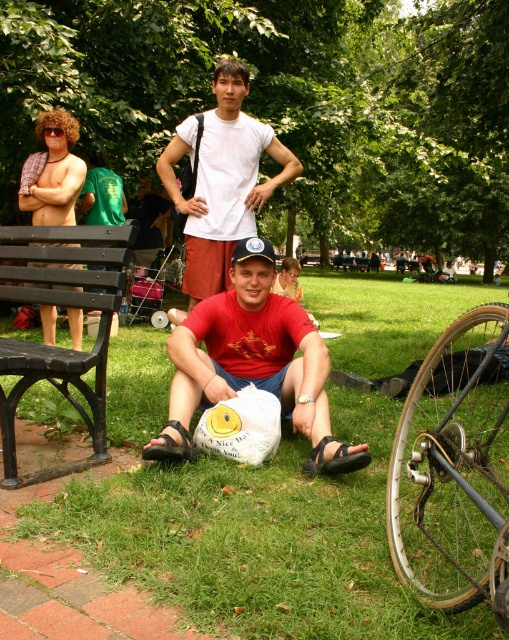
Does black wood bench at left appear over green fabric backpack at upper left?

Actually, black wood bench at left is below green fabric backpack at upper left.

Is black wood bench at left shorter than green fabric backpack at upper left?

In fact, black wood bench at left may be taller than green fabric backpack at upper left.

This screenshot has height=640, width=509. Identify the location of black wood bench at left. (56, 346).

Where is `black wood bench at left`? black wood bench at left is located at coordinates (56, 346).

Is green grass at lower center to the right of white cotton t-shirt at center from the viewer's perspective?

Correct, you'll find green grass at lower center to the right of white cotton t-shirt at center.

Is point (189, 540) closer to camera compared to point (218, 220)?

Yes, point (189, 540) is closer to viewer.

At what (x,y) coordinates should I click in order to perform the action: click on green grass at lower center. Please return your answer as a coordinate pair (x, y). This screenshot has width=509, height=640. Looking at the image, I should click on (261, 540).

Is green grass at lower center bigger than black wood bench at left?

Correct, green grass at lower center is larger in size than black wood bench at left.

Is green grass at lower center wider than black wood bench at left?

Correct, the width of green grass at lower center exceeds that of black wood bench at left.

Locate an element on the screen. The width and height of the screenshot is (509, 640). green grass at lower center is located at coordinates (261, 540).